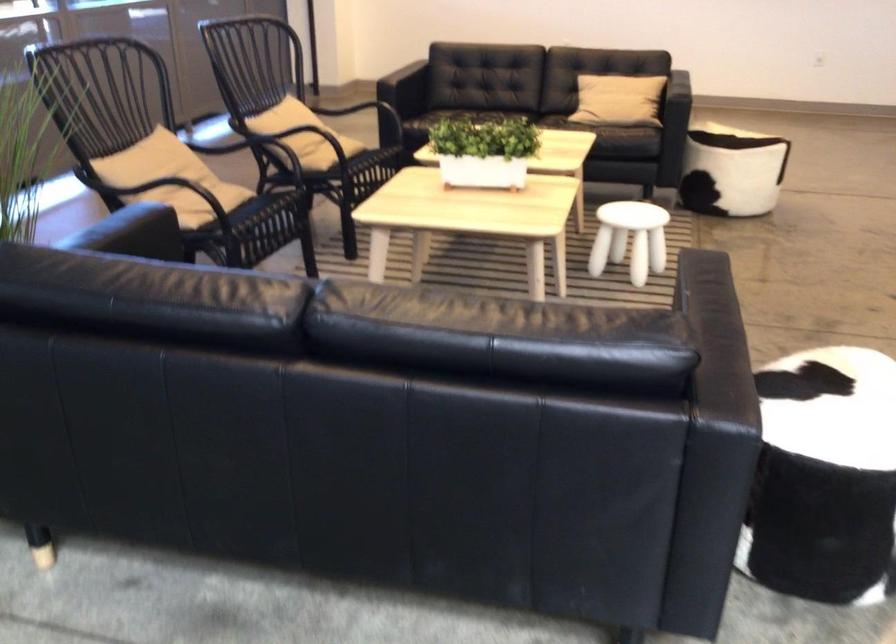
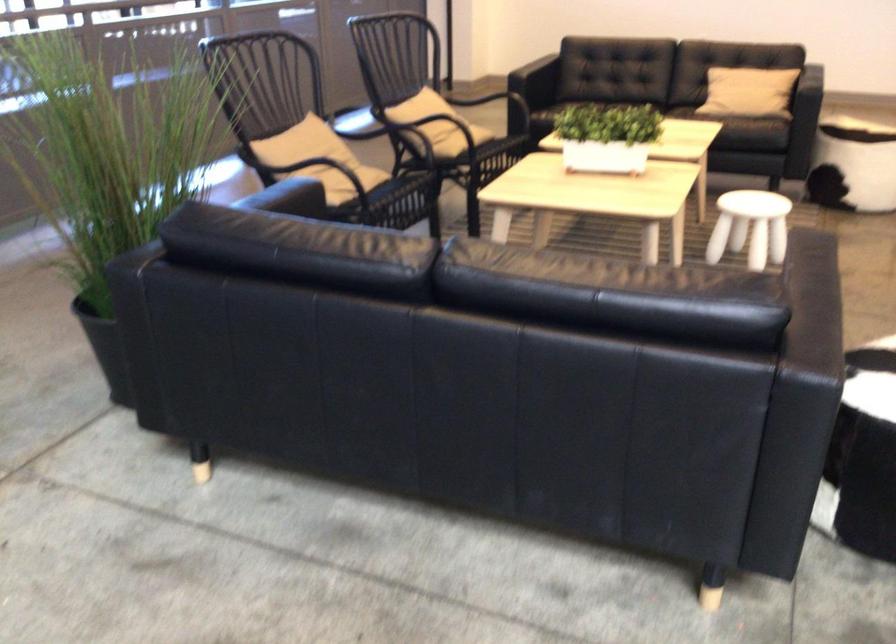
Where in the second image is the point corresponding to pixel 158 176 from the first image?

(308, 153)